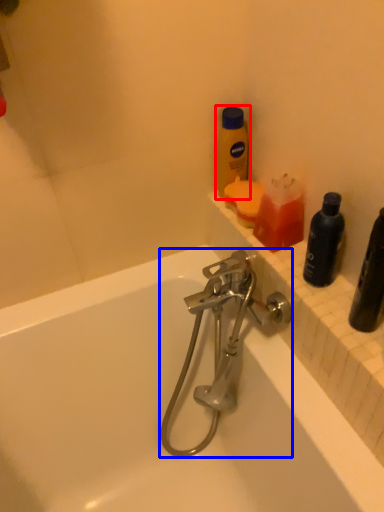
Question: Which point is further to the camera, bottle (highlighted by a red box) or tap (highlighted by a blue box)?

Choices:
 (A) bottle
 (B) tap

Answer: (A)